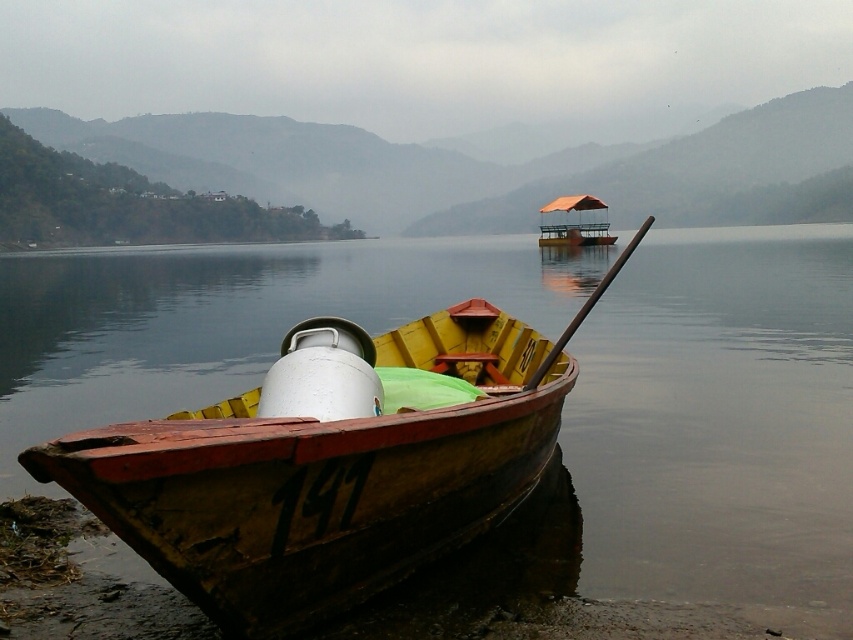
Who is lower down, wooden boat at lower left or orange canvas boat at center?

wooden boat at lower left

Which is behind, point (231, 548) or point (579, 240)?

Positioned behind is point (579, 240).

Is point (294, 529) more distant than point (538, 237)?

No, (294, 529) is closer to viewer.

Locate an element on the screen. The height and width of the screenshot is (640, 853). wooden boat at lower left is located at coordinates (329, 465).